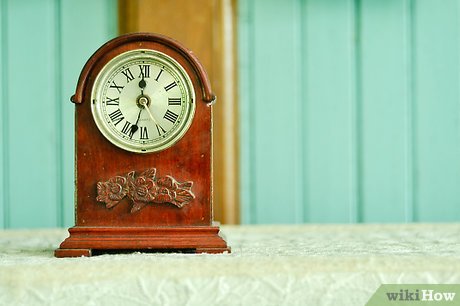
The width and height of the screenshot is (460, 306). I want to click on dark spot on tablecloth on left of clock, so click(x=37, y=253).